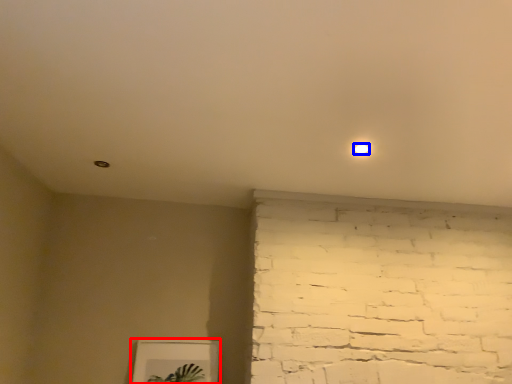
Question: Among these objects, which one is farthest to the camera, picture frame (highlighted by a red box) or light (highlighted by a blue box)?

Choices:
 (A) picture frame
 (B) light

Answer: (A)